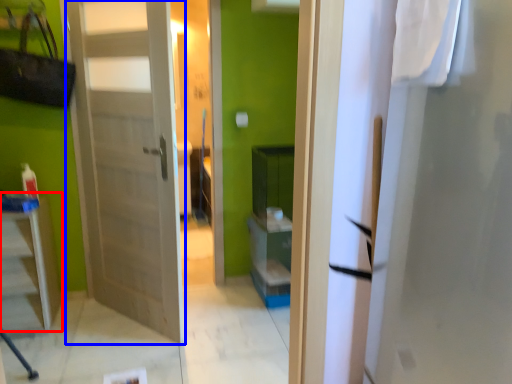
Question: Which object appears farthest to the camera in this image, furniture (highlighted by a red box) or door (highlighted by a blue box)?

Choices:
 (A) furniture
 (B) door

Answer: (A)